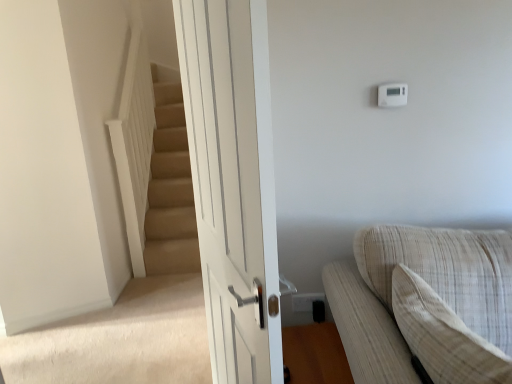
Question: In terms of width, does beige textured couch at lower right look wider or thinner when compared to light beige textured pillow at right?

Choices:
 (A) wide
 (B) thin

Answer: (A)

Question: In the image, is beige textured couch at lower right on the left side or the right side of light beige textured pillow at right?

Choices:
 (A) left
 (B) right

Answer: (B)

Question: Which of these objects is positioned farthest from the white plastic thermostat at upper right?

Choices:
 (A) light beige textured pillow at right
 (B) beige textured couch at lower right
 (C) white glossy door at center
 (D) white plastic electric outlet at lower right

Answer: (D)

Question: Which is nearer to the white plastic electric outlet at lower right?

Choices:
 (A) light beige textured pillow at right
 (B) white glossy door at center
 (C) white plastic thermostat at upper right
 (D) beige textured couch at lower right

Answer: (D)